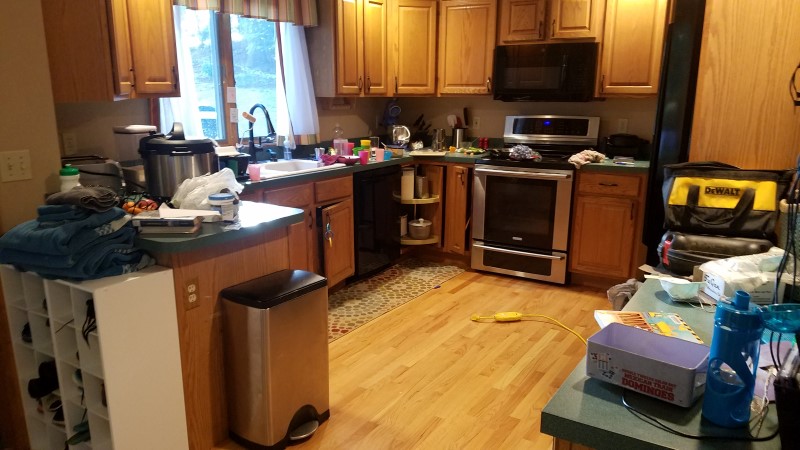
Locate an element on the screen. window is located at coordinates (258, 73).